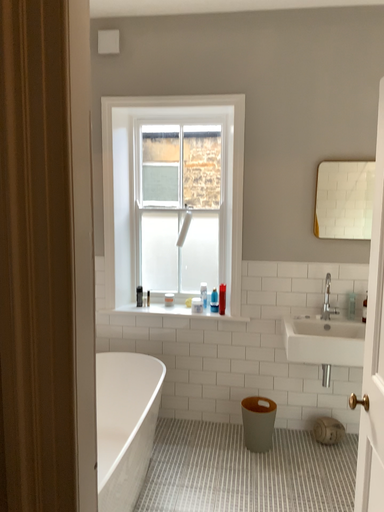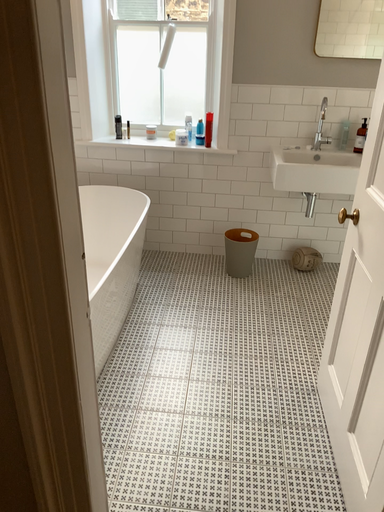
Question: Which way did the camera rotate in the video?

Choices:
 (A) rotated upward
 (B) rotated downward

Answer: (B)